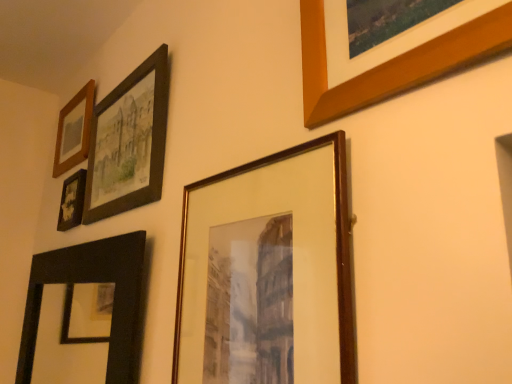
Question: From the image's perspective, is wooden frame at center, placed as the 2th picture frame when sorted from right to left, located above or below wooden frame at upper left, the 1th picture frame positioned from the left?

Choices:
 (A) above
 (B) below

Answer: (B)

Question: Does point (261, 163) appear closer or farther from the camera than point (58, 160)?

Choices:
 (A) farther
 (B) closer

Answer: (B)

Question: Based on their relative distances, which object is farther from the wooden frame at upper left, the 1th picture frame positioned from the left?

Choices:
 (A) matte black frame at upper left, the 3th picture frame from the right
 (B) black matte mirror at lower left, arranged as the 3th picture frame when viewed from the left
 (C) wooden frame at center, placed as the 2th picture frame when sorted from right to left
 (D) matte black photo frame at upper left, the 5th picture frame from the right
 (E) wooden picture frame at upper right, the first picture frame in the right-to-left sequence

Answer: (E)

Question: Estimate the real-world distances between objects in this image. Which object is closer to the wooden picture frame at upper right, the first picture frame in the right-to-left sequence?

Choices:
 (A) black matte mirror at lower left, arranged as the fourth picture frame when viewed from the right
 (B) matte black photo frame at upper left, the 2th picture frame viewed from the left
 (C) wooden frame at center, the fifth picture frame viewed from the left
 (D) matte black frame at upper left, the 3th picture frame from the right
 (E) wooden frame at upper left, the 1th picture frame positioned from the left

Answer: (C)